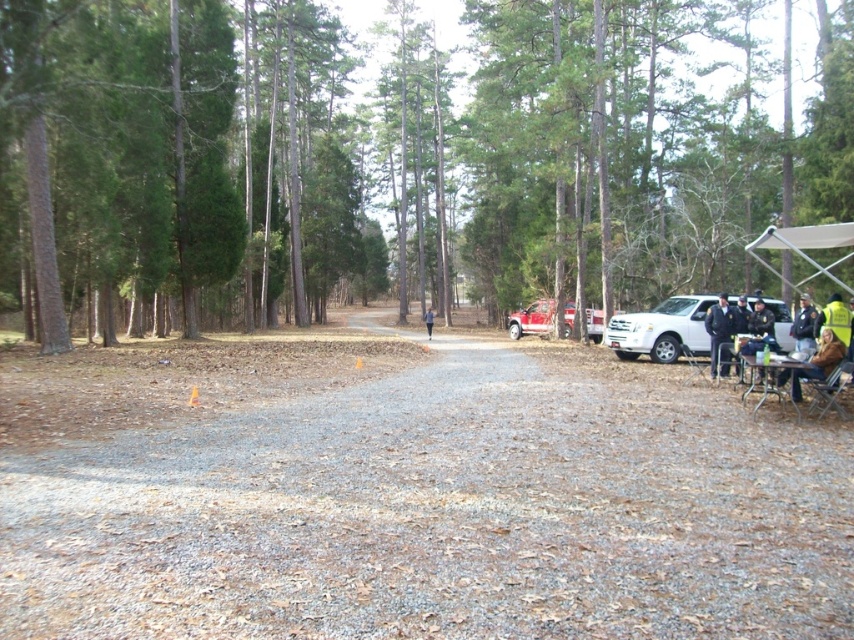
Who is higher up, brown textured tree at center or dark blue fabric at center?

brown textured tree at center is above.

Does brown textured tree at center have a greater height compared to dark blue fabric at center?

Correct, brown textured tree at center is much taller as dark blue fabric at center.

The image size is (854, 640). I want to click on brown textured tree at center, so click(x=396, y=157).

Can you confirm if white matte suv at right is taller than matte red truck at center?

Incorrect, white matte suv at right's height is not larger of matte red truck at center's.

Does white matte suv at right have a smaller size compared to matte red truck at center?

Yes, white matte suv at right is smaller than matte red truck at center.

What do you see at coordinates (662, 330) in the screenshot?
I see `white matte suv at right` at bounding box center [662, 330].

Where is `white matte suv at right`? white matte suv at right is located at coordinates (662, 330).

Does gray gravel dirt track at center have a smaller size compared to black uniformed officer at right?

Correct, gray gravel dirt track at center occupies less space than black uniformed officer at right.

Who is positioned more to the left, gray gravel dirt track at center or black uniformed officer at right?

Positioned to the left is gray gravel dirt track at center.

Which is in front, point (243, 515) or point (799, 301)?

Point (243, 515) is in front.

I want to click on gray gravel dirt track at center, so click(x=443, y=513).